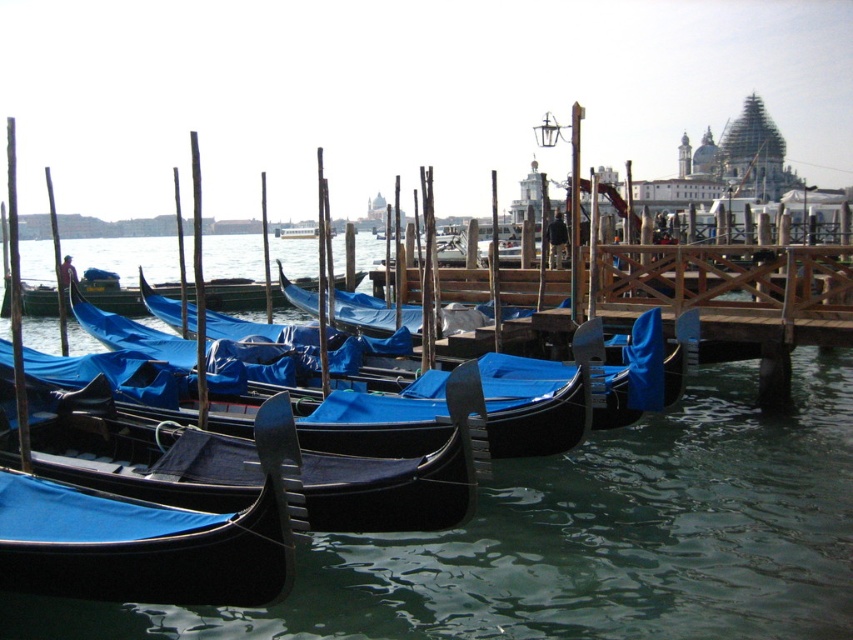
Question: Can you confirm if shiny black gondola at center is wider than blue glossy gondola at center?

Choices:
 (A) no
 (B) yes

Answer: (A)

Question: Which point is farther to the camera?

Choices:
 (A) (358, 497)
 (B) (213, 288)
 (C) (752, 513)

Answer: (B)

Question: Which point is closer to the camera?

Choices:
 (A) shiny black gondola at center
 (B) greenish water at center
 (C) blue glossy gondola at center

Answer: (A)

Question: From the image, what is the correct spatial relationship of greenish water at center in relation to blue glossy gondola at center?

Choices:
 (A) right
 (B) left

Answer: (A)

Question: Is shiny black gondola at center wider than blue glossy gondola at center?

Choices:
 (A) yes
 (B) no

Answer: (B)

Question: Which of the following is the closest to the observer?

Choices:
 (A) blue glossy gondola at center
 (B) greenish water at center
 (C) shiny black gondola at center

Answer: (C)